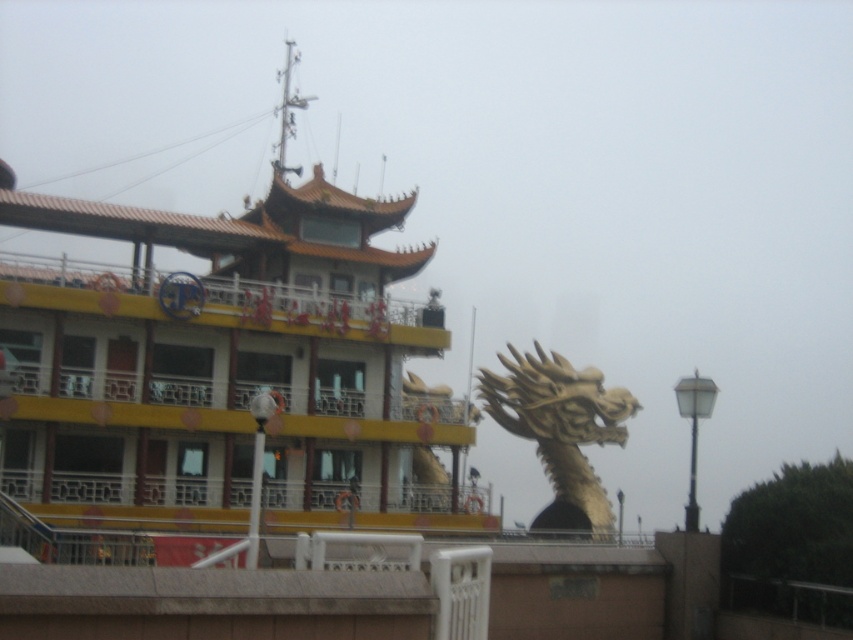
Question: Which point is farther to the camera?

Choices:
 (A) (317, 237)
 (B) (624, 404)

Answer: (B)

Question: Which object is positioned farthest from the yellow matte boat at upper left?

Choices:
 (A) gold metallic dragon at center
 (B) white glass lamp post at right

Answer: (B)

Question: Which point is farther to the camera?

Choices:
 (A) yellow matte boat at upper left
 (B) gold metallic dragon at center
 (C) white glass lamp post at right

Answer: (B)

Question: In this image, where is yellow matte boat at upper left located relative to white glass lamp post at right?

Choices:
 (A) below
 (B) above

Answer: (B)

Question: Can you confirm if yellow matte boat at upper left is positioned to the left of gold metallic dragon at center?

Choices:
 (A) yes
 (B) no

Answer: (A)

Question: Is yellow matte boat at upper left positioned before white glass lamp post at right?

Choices:
 (A) no
 (B) yes

Answer: (A)